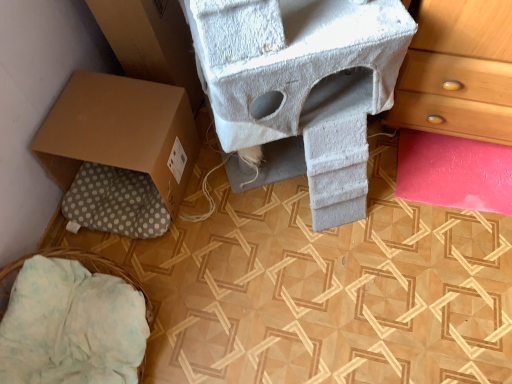
Question: Is brown cardboard box at lower left surrounded by brown cardboard box at left?

Choices:
 (A) yes
 (B) no

Answer: (B)

Question: Can you confirm if brown cardboard box at left is taller than brown cardboard box at lower left?

Choices:
 (A) yes
 (B) no

Answer: (A)

Question: Is brown cardboard box at left wider than brown cardboard box at lower left?

Choices:
 (A) yes
 (B) no

Answer: (B)

Question: Can you confirm if brown cardboard box at left is positioned to the right of brown cardboard box at lower left?

Choices:
 (A) no
 (B) yes

Answer: (B)

Question: Is brown cardboard box at left to the left of brown cardboard box at lower left from the viewer's perspective?

Choices:
 (A) yes
 (B) no

Answer: (B)

Question: From the image's perspective, is brown cardboard box at left on top of brown cardboard box at lower left?

Choices:
 (A) yes
 (B) no

Answer: (A)

Question: Does white fabric basket at lower left appear on the right side of brown cardboard box at lower left?

Choices:
 (A) no
 (B) yes

Answer: (A)

Question: Considering the relative sizes of white fabric basket at lower left and brown cardboard box at lower left in the image provided, is white fabric basket at lower left shorter than brown cardboard box at lower left?

Choices:
 (A) yes
 (B) no

Answer: (A)

Question: From the image's perspective, is white fabric basket at lower left located beneath brown cardboard box at lower left?

Choices:
 (A) yes
 (B) no

Answer: (A)

Question: Can you confirm if white fabric basket at lower left is positioned to the left of brown cardboard box at lower left?

Choices:
 (A) no
 (B) yes

Answer: (B)

Question: Is brown cardboard box at lower left inside white fabric basket at lower left?

Choices:
 (A) no
 (B) yes

Answer: (A)

Question: Is white fabric basket at lower left not close to brown cardboard box at lower left?

Choices:
 (A) no
 (B) yes

Answer: (A)

Question: Is white fabric basket at lower left completely or partially outside of brown cardboard box at left?

Choices:
 (A) no
 (B) yes

Answer: (B)